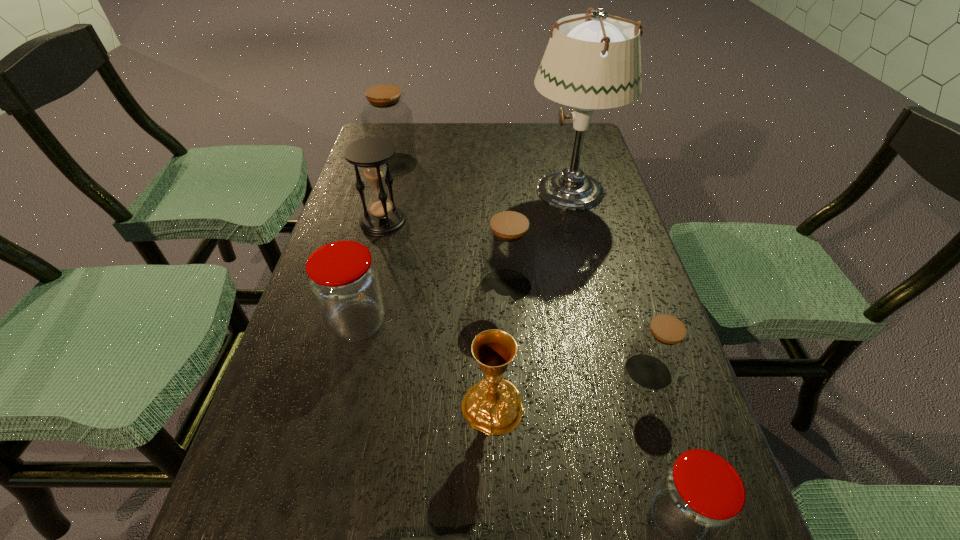
This screenshot has width=960, height=540. Find the location of `object present at the far edge`. object present at the far edge is located at coordinates (385, 115).

The image size is (960, 540). In order to click on hourglass at the left edge in this screenshot , I will do `click(371, 154)`.

Identify the location of lampshade that is at the right edge. (596, 64).

Locate an element on the screen. The width and height of the screenshot is (960, 540). jar that is at the right edge is located at coordinates (659, 347).

I want to click on object situated at the far left corner, so click(x=385, y=115).

In the image, there is a desktop. Where is `vacant space at the far edge`? vacant space at the far edge is located at coordinates (489, 150).

Image resolution: width=960 pixels, height=540 pixels. What are the coordinates of `free spot at the left edge of the desktop` in the screenshot? It's located at (385, 275).

Locate an element on the screen. free space at the right edge of the desktop is located at coordinates (633, 538).

The height and width of the screenshot is (540, 960). In order to click on free space between the gold chalice and the hourglass in this screenshot , I will do `click(438, 314)`.

Where is `empty space between the farthest jar and the bigger red jar`? empty space between the farthest jar and the bigger red jar is located at coordinates (375, 244).